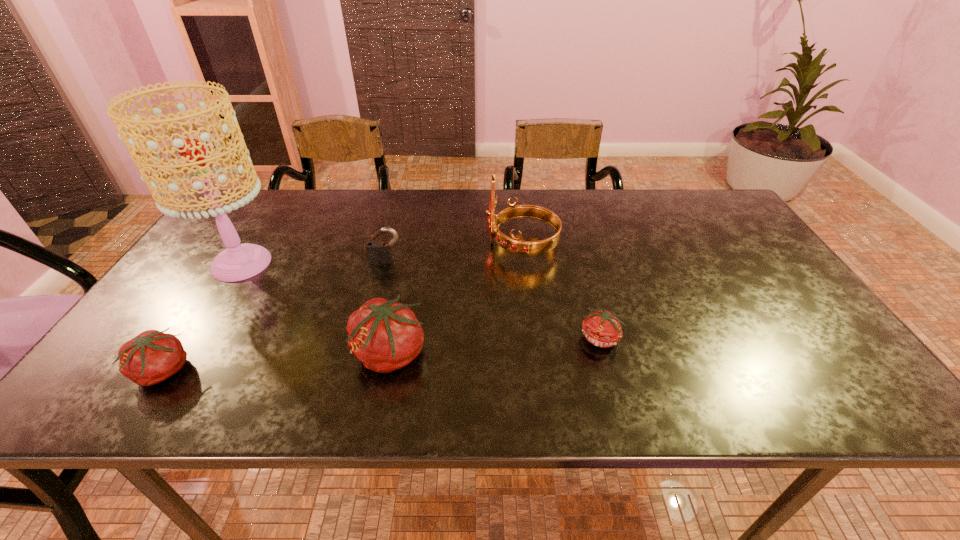
Considering the uniform spacing of tomatos, where should an additional tomato be positioned on the right? Please locate a free spot. Please provide its 2D coordinates. Your answer should be formatted as a tuple, i.e. [(x, y)], where the tuple contains the x and y coordinates of a point satisfying the conditions above.

[(800, 323)]